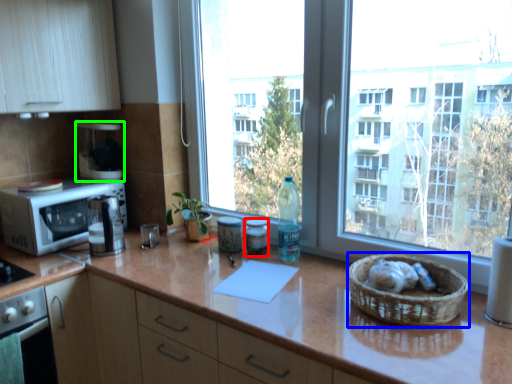
Question: Which is farther away from appliance (highlighted by a red box)? basket (highlighted by a blue box) or appliance (highlighted by a green box)?

Choices:
 (A) basket
 (B) appliance

Answer: (B)